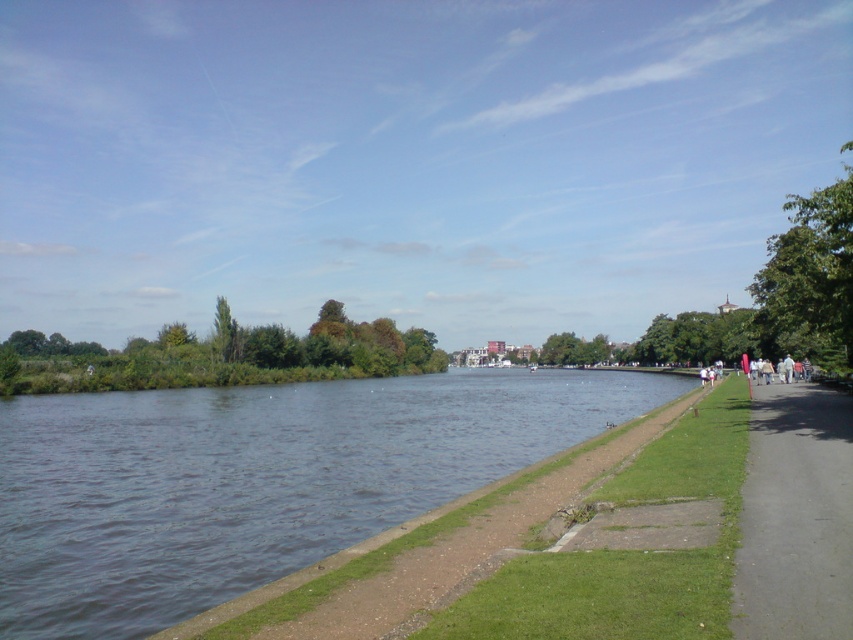
Question: Which of the following is the farthest from the observer?

Choices:
 (A) green leafy tree at center
 (B) green leafy trees at center
 (C) black asphalt path at right

Answer: (A)

Question: Which object is closer to the camera taking this photo?

Choices:
 (A) green leafy tree at upper right
 (B) green leafy tree at center
 (C) black asphalt path at right

Answer: (C)

Question: Which object appears farthest from the camera in this image?

Choices:
 (A) green leafy tree at upper right
 (B) green leafy tree at upper left
 (C) green leafy tree at center

Answer: (B)

Question: Is the position of dark blue water at center less distant than that of green leafy tree at upper left?

Choices:
 (A) no
 (B) yes

Answer: (B)

Question: Can you confirm if green leafy trees at center is wider than green leafy tree at upper left?

Choices:
 (A) yes
 (B) no

Answer: (A)

Question: Does dark blue water at center appear over green leafy trees at center?

Choices:
 (A) yes
 (B) no

Answer: (B)